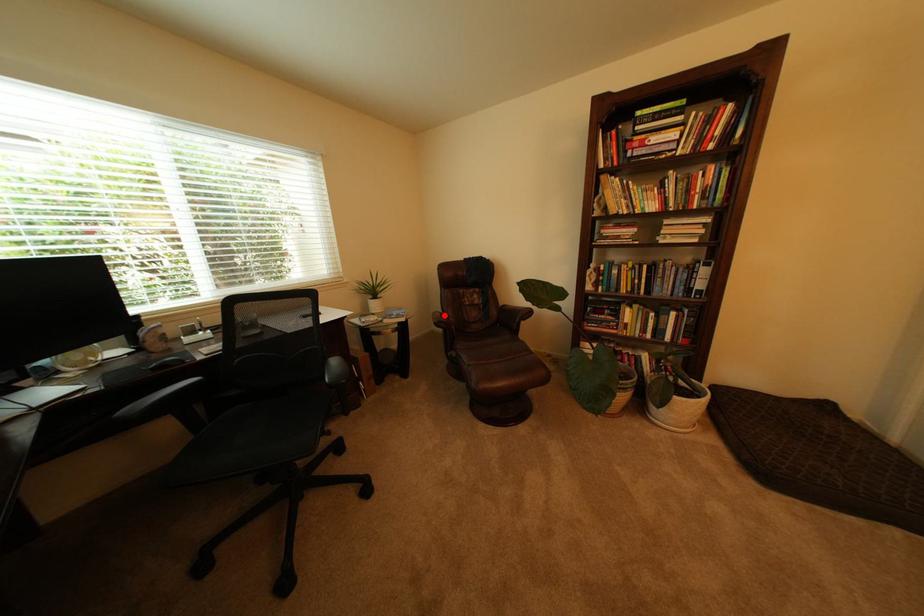
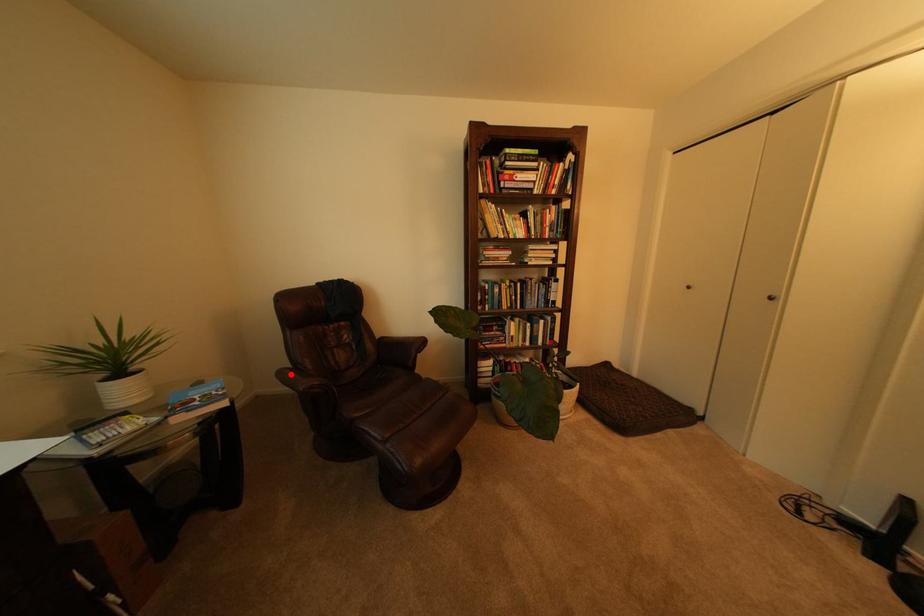
I am providing you with two images of the same scene from different viewpoints. A red point is marked on the first image and another point is marked on the second image. Are the points marked in image1 and image2 representing the same 3D position?

Yes